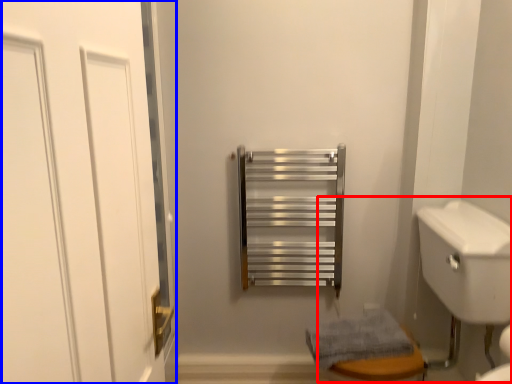
Question: Which object appears farthest to the camera in this image, sink (highlighted by a red box) or door (highlighted by a blue box)?

Choices:
 (A) sink
 (B) door

Answer: (A)